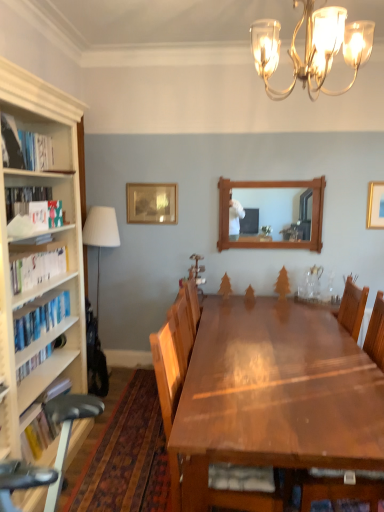
Question: Is there a large distance between gold metallic chandelier at upper center and wooden picture frame at upper center, arranged as the 2th picture frame when viewed from the right?

Choices:
 (A) no
 (B) yes

Answer: (B)

Question: From a real-world perspective, does gold metallic chandelier at upper center sit lower than wooden picture frame at upper center, which is the first picture frame from left to right?

Choices:
 (A) yes
 (B) no

Answer: (B)

Question: Does gold metallic chandelier at upper center lie in front of wooden picture frame at upper center, arranged as the 2th picture frame when viewed from the right?

Choices:
 (A) yes
 (B) no

Answer: (A)

Question: From a real-world perspective, is gold metallic chandelier at upper center positioned over wooden picture frame at upper center, the first picture frame in the back-to-front sequence, based on gravity?

Choices:
 (A) yes
 (B) no

Answer: (A)

Question: Does gold metallic chandelier at upper center have a lesser height compared to wooden picture frame at upper center, which is the first picture frame from left to right?

Choices:
 (A) no
 (B) yes

Answer: (A)

Question: Is point click(99, 208) positioned closer to the camera than point click(16, 377)?

Choices:
 (A) closer
 (B) farther

Answer: (B)

Question: Considering the positions of white fabric lampshade at left and hardcover book at left, the 5th book positioned from the top, in the image, is white fabric lampshade at left taller or shorter than hardcover book at left, the 5th book positioned from the top,?

Choices:
 (A) short
 (B) tall

Answer: (B)

Question: Considering the positions of white fabric lampshade at left and hardcover book at left, the 5th book positioned from the top, in the image, is white fabric lampshade at left bigger or smaller than hardcover book at left, the 5th book positioned from the top,?

Choices:
 (A) small
 (B) big

Answer: (B)

Question: Based on their positions, is white fabric lampshade at left located to the left or right of hardcover book at left, the 1th book from the bottom?

Choices:
 (A) left
 (B) right

Answer: (B)

Question: In the image, is hardcover books at left, the second book positioned from the bottom, on the left side or the right side of wooden picture frame at upper center, which appears as the 2th picture frame when viewed from the front?

Choices:
 (A) right
 (B) left

Answer: (B)

Question: Considering the positions of hardcover books at left, which is counted as the 4th book, starting from the top, and wooden picture frame at upper center, which is the first picture frame from left to right, in the image, is hardcover books at left, which is counted as the 4th book, starting from the top, wider or thinner than wooden picture frame at upper center, which is the first picture frame from left to right,?

Choices:
 (A) thin
 (B) wide

Answer: (B)

Question: From a real-world perspective, is hardcover books at left, the second book positioned from the bottom, physically located above or below wooden picture frame at upper center, which is the first picture frame from left to right?

Choices:
 (A) above
 (B) below

Answer: (B)

Question: Considering their positions, is hardcover books at left, which is counted as the 4th book, starting from the top, located in front of or behind wooden picture frame at upper center, arranged as the 2th picture frame when viewed from the right?

Choices:
 (A) behind
 (B) front

Answer: (B)

Question: In terms of size, does gold metallic picture frame at upper right, the second picture frame when ordered from back to front, appear bigger or smaller than white fabric lampshade at left?

Choices:
 (A) big
 (B) small

Answer: (B)

Question: Is gold metallic picture frame at upper right, the first picture frame positioned from the front, inside the boundaries of white fabric lampshade at left, or outside?

Choices:
 (A) outside
 (B) inside

Answer: (A)